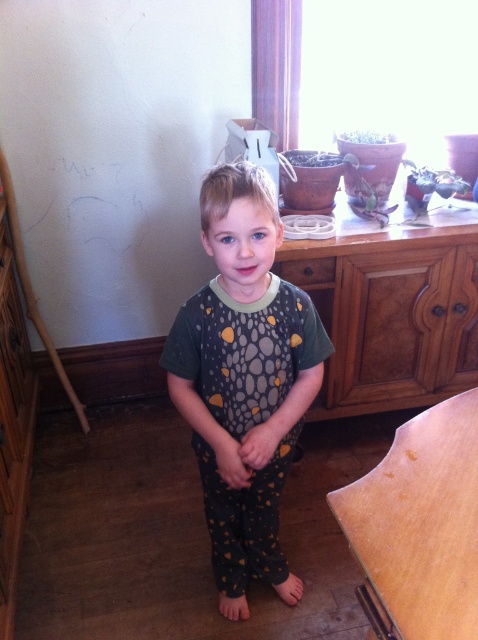
Is point (263, 556) positioned in front of point (383, 369)?

Yes, point (263, 556) is closer to viewer.

You are a GUI agent. You are given a task and a screenshot of the screen. Output one action in this format:
    pyautogui.click(x=<x>, y=<y>)
    Task: Click on the dark green jersey at center
    The height and width of the screenshot is (640, 478).
    Given the screenshot: What is the action you would take?
    pyautogui.click(x=245, y=380)

Identify the location of dark green jersey at center. Image resolution: width=478 pixels, height=640 pixels. (245, 380).

Does point (467, 280) come behind point (442, 586)?

Yes.

Which is below, brown wood dresser at center or wooden at center?

Positioned lower is wooden at center.

Between point (343, 292) and point (400, 536), which one is positioned in front?

Positioned in front is point (400, 536).

Where is `brown wood dresser at center`? The height and width of the screenshot is (640, 478). brown wood dresser at center is located at coordinates (391, 308).

Which is more to the left, dark green jersey at center or wooden at center?

dark green jersey at center

Is dark green jersey at center to the right of wooden at center from the viewer's perspective?

Incorrect, dark green jersey at center is not on the right side of wooden at center.

Find the location of a particular element. This screenshot has width=478, height=640. dark green jersey at center is located at coordinates (245, 380).